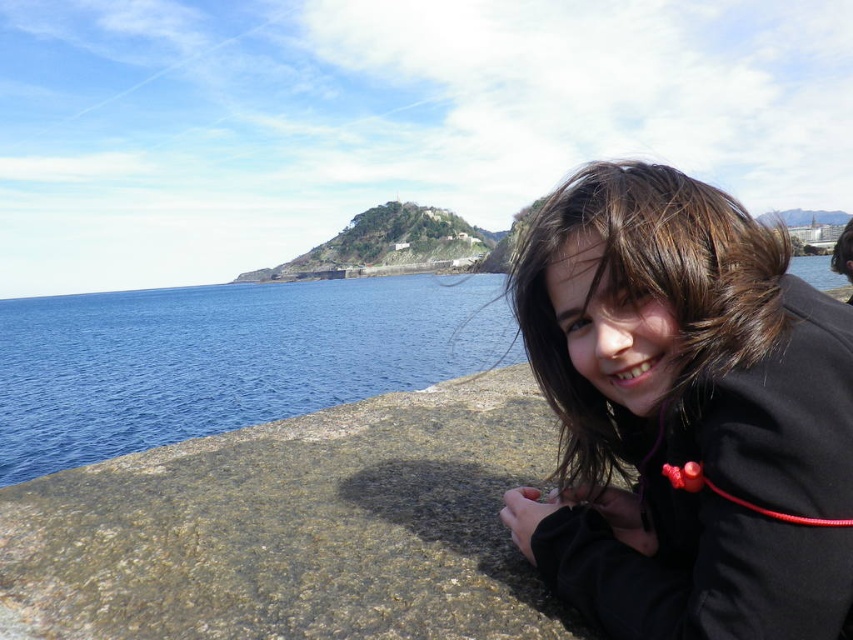
Question: Observing the image, what is the correct spatial positioning of black matte jacket at lower right in reference to brown hair at lower right?

Choices:
 (A) above
 (B) below

Answer: (B)

Question: Among these objects, which one is nearest to the camera?

Choices:
 (A) gray rough stone at lower right
 (B) black matte jacket at lower right
 (C) brown hair at lower right
 (D) blue water at left

Answer: (B)

Question: Is blue water at left to the right of brown hair at lower right from the viewer's perspective?

Choices:
 (A) yes
 (B) no

Answer: (B)

Question: Which object is positioned closest to the black matte jacket at lower right?

Choices:
 (A) brown hair at lower right
 (B) gray rough stone at lower right

Answer: (B)

Question: Which object appears farthest from the camera in this image?

Choices:
 (A) blue water at left
 (B) brown hair at lower right
 (C) gray rough stone at lower right
 (D) black matte jacket at lower right

Answer: (B)

Question: Can you confirm if gray rough stone at lower right is positioned to the left of brown hair at lower right?

Choices:
 (A) no
 (B) yes

Answer: (B)